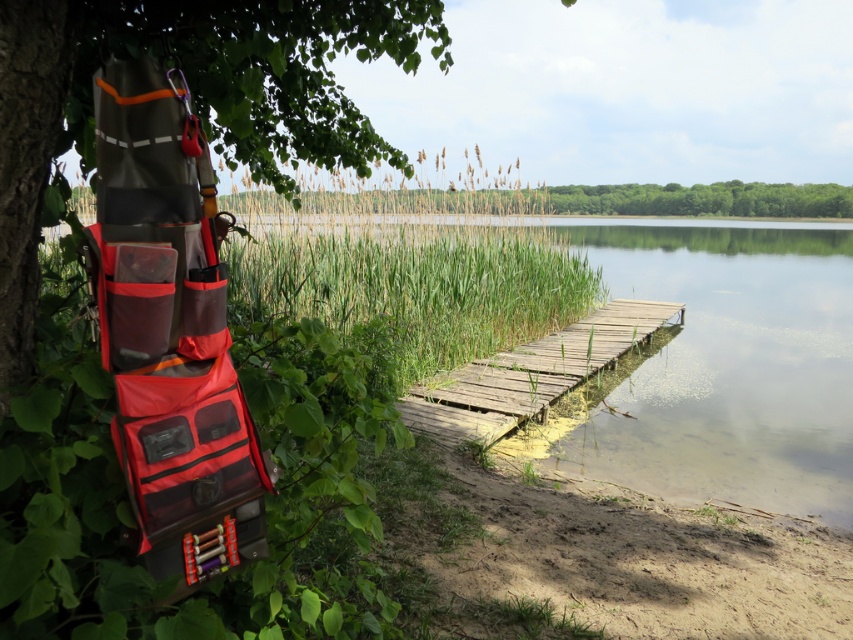
Who is more forward, (32, 253) or (645, 184)?

Positioned in front is point (32, 253).

Identify the location of orange fabric bag at left. (190, 100).

Is point (146, 38) closer to camera compared to point (601, 200)?

Yes, point (146, 38) is closer to viewer.

Identify the location of orange fabric bag at left. This screenshot has height=640, width=853. (190, 100).

Is green grassy reed at center closer to camera compared to green leafy tree at upper center?

Yes, green grassy reed at center is closer to the viewer.

Between point (431, 260) and point (708, 205), which one is positioned behind?

Point (708, 205)

What do you see at coordinates (403, 282) in the screenshot? Image resolution: width=853 pixels, height=640 pixels. I see `green grassy reed at center` at bounding box center [403, 282].

This screenshot has width=853, height=640. Identify the location of green grassy reed at center. (403, 282).

Between point (4, 294) and point (334, 305), which one is positioned in front?

Positioned in front is point (4, 294).

Between orange fabric bag at left and green grassy reed at center, which one appears on the right side from the viewer's perspective?

Positioned to the right is green grassy reed at center.

The image size is (853, 640). What do you see at coordinates (190, 100) in the screenshot?
I see `orange fabric bag at left` at bounding box center [190, 100].

Where is `orange fabric bag at left`? The height and width of the screenshot is (640, 853). orange fabric bag at left is located at coordinates [190, 100].